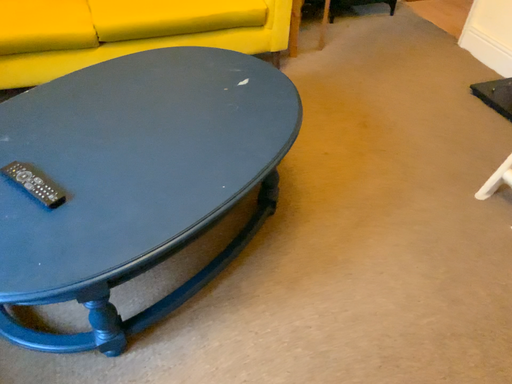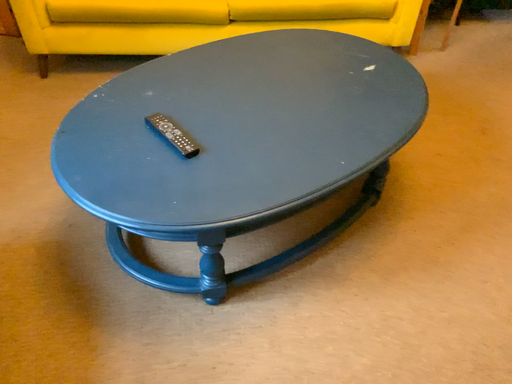
Question: Which way did the camera rotate in the video?

Choices:
 (A) rotated right
 (B) rotated left

Answer: (B)